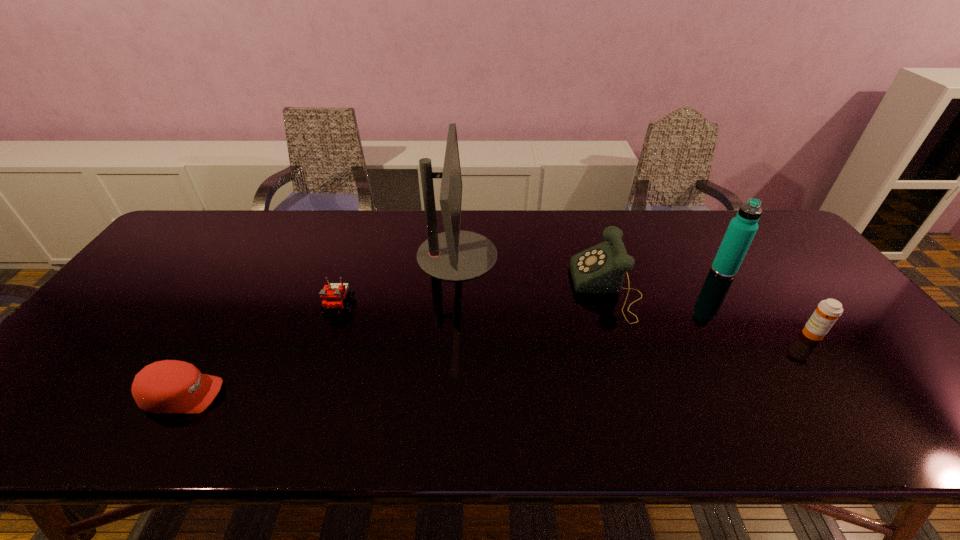
Locate an element on the screen. cap is located at coordinates (170, 386).

Where is `vacant space located on the screen of the tallest object`? vacant space located on the screen of the tallest object is located at coordinates (516, 255).

Locate an element on the screen. vacant space located 0.140m on the front of the second tallest object is located at coordinates coord(751,313).

I want to click on free space located on the dial of the telephone, so click(521, 289).

Identify the location of blank area located 0.090m on the dial of the telephone. 542,289.

This screenshot has height=540, width=960. I want to click on free space located 0.050m on the dial of the telephone, so [x=557, y=289].

Find the location of a particular element. The width and height of the screenshot is (960, 540). vacant area situated 0.120m on the front of the fifth farthest object is located at coordinates (847, 381).

Find the location of a particular element. The height and width of the screenshot is (540, 960). free space located on the front-facing side of the Lego is located at coordinates (324, 348).

What are the coordinates of `vacant space located 0.310m on the front-facing side of the nearest object` in the screenshot? It's located at (361, 395).

Find the location of `object positioned at the far edge`. object positioned at the far edge is located at coordinates (454, 255).